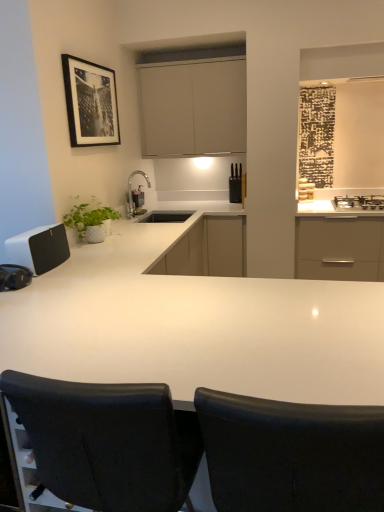
Question: Does black leather chair at center, placed as the 2th chair when sorted from right to left, have a smaller size compared to black leather chair at center, which ranks as the first chair in right-to-left order?

Choices:
 (A) yes
 (B) no

Answer: (B)

Question: Is black leather chair at center, placed as the 2th chair when sorted from right to left, positioned far away from black leather chair at center, which is the 2th chair from left to right?

Choices:
 (A) no
 (B) yes

Answer: (A)

Question: Is black leather chair at center, placed as the 2th chair when sorted from right to left, to the left of black leather chair at center, which is the 2th chair from left to right, from the viewer's perspective?

Choices:
 (A) yes
 (B) no

Answer: (A)

Question: Considering the relative sizes of black leather chair at center, placed as the 2th chair when sorted from right to left, and black leather chair at center, which ranks as the first chair in right-to-left order, in the image provided, is black leather chair at center, placed as the 2th chair when sorted from right to left, wider than black leather chair at center, which ranks as the first chair in right-to-left order,?

Choices:
 (A) no
 (B) yes

Answer: (B)

Question: From a real-world perspective, is black leather chair at center, which ranks as the first chair in left-to-right order, below black leather chair at center, which is the 2th chair from left to right?

Choices:
 (A) yes
 (B) no

Answer: (A)

Question: In the image, is matte white cabinet at upper center, which appears as the 2th cabinetry when ordered from the bottom, on the left side or the right side of black leather chair at center, placed as the 2th chair when sorted from right to left?

Choices:
 (A) right
 (B) left

Answer: (A)

Question: In terms of size, does matte white cabinet at upper center, the first cabinetry from the top, appear bigger or smaller than black leather chair at center, which ranks as the first chair in left-to-right order?

Choices:
 (A) big
 (B) small

Answer: (A)

Question: In terms of width, does matte white cabinet at upper center, which appears as the 2th cabinetry when ordered from the bottom, look wider or thinner when compared to black leather chair at center, placed as the 2th chair when sorted from right to left?

Choices:
 (A) thin
 (B) wide

Answer: (A)

Question: Considering their positions, is matte white cabinet at upper center, the first cabinetry from the top, located in front of or behind black leather chair at center, placed as the 2th chair when sorted from right to left?

Choices:
 (A) behind
 (B) front

Answer: (A)

Question: In terms of height, does black glass gas stove at upper right look taller or shorter compared to black plastic knife block at upper center, the 1th appliance from the top?

Choices:
 (A) tall
 (B) short

Answer: (B)

Question: From the image's perspective, is black glass gas stove at upper right positioned above or below black plastic knife block at upper center, marked as the 2th appliance in a bottom-to-top arrangement?

Choices:
 (A) below
 (B) above

Answer: (A)

Question: Considering the relative positions of black glass gas stove at upper right and black plastic knife block at upper center, arranged as the 1th appliance when viewed from the right, in the image provided, is black glass gas stove at upper right to the left or to the right of black plastic knife block at upper center, arranged as the 1th appliance when viewed from the right,?

Choices:
 (A) right
 (B) left

Answer: (A)

Question: Considering the positions of black glass gas stove at upper right and black plastic knife block at upper center, which is counted as the 2th appliance, starting from the front, in the image, is black glass gas stove at upper right wider or thinner than black plastic knife block at upper center, which is counted as the 2th appliance, starting from the front,?

Choices:
 (A) wide
 (B) thin

Answer: (A)

Question: Looking at the image, does black glass gas stove at upper right seem bigger or smaller compared to white matte cabinet at center, the 1th cabinetry ordered from the bottom?

Choices:
 (A) small
 (B) big

Answer: (A)

Question: Visually, is black glass gas stove at upper right positioned to the left or to the right of white matte cabinet at center, the 2th cabinetry in the top-to-bottom sequence?

Choices:
 (A) right
 (B) left

Answer: (A)